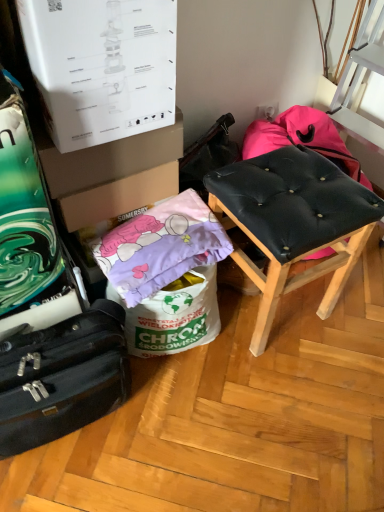
Question: From a real-world perspective, is black leather stool at right located higher than brown cardboard box at upper left, acting as the second cardboard box starting from the bottom?

Choices:
 (A) yes
 (B) no

Answer: (B)

Question: Could brown cardboard box at upper left, which is counted as the first cardboard box, starting from the top, be considered to be inside black leather stool at right?

Choices:
 (A) no
 (B) yes

Answer: (A)

Question: Is black leather stool at right turned away from brown cardboard box at upper left, acting as the second cardboard box starting from the bottom?

Choices:
 (A) yes
 (B) no

Answer: (B)

Question: Is black leather stool at right at the left side of brown cardboard box at upper left, which is counted as the first cardboard box, starting from the top?

Choices:
 (A) yes
 (B) no

Answer: (B)

Question: From the image's perspective, would you say black leather stool at right is shown under brown cardboard box at upper left, acting as the second cardboard box starting from the bottom?

Choices:
 (A) yes
 (B) no

Answer: (A)

Question: Considering their positions, is purple fabric pillow at lower left located in front of or behind brown cardboard box at center, marked as the 2th cardboard box in a top-to-bottom arrangement?

Choices:
 (A) front
 (B) behind

Answer: (A)

Question: Considering the positions of purple fabric pillow at lower left and brown cardboard box at center, marked as the 2th cardboard box in a top-to-bottom arrangement, in the image, is purple fabric pillow at lower left bigger or smaller than brown cardboard box at center, marked as the 2th cardboard box in a top-to-bottom arrangement,?

Choices:
 (A) big
 (B) small

Answer: (A)

Question: Choose the correct answer: Is purple fabric pillow at lower left inside brown cardboard box at center, marked as the 2th cardboard box in a top-to-bottom arrangement, or outside it?

Choices:
 (A) outside
 (B) inside

Answer: (A)

Question: From the image's perspective, relative to brown cardboard box at center, the 1th cardboard box positioned from the bottom, is purple fabric pillow at lower left above or below?

Choices:
 (A) below
 (B) above

Answer: (A)

Question: In the image, is brown cardboard box at upper left, acting as the second cardboard box starting from the bottom, positioned in front of or behind black leather stool at right?

Choices:
 (A) behind
 (B) front

Answer: (A)

Question: Based on their sizes in the image, would you say brown cardboard box at upper left, acting as the second cardboard box starting from the bottom, is bigger or smaller than black leather stool at right?

Choices:
 (A) small
 (B) big

Answer: (A)

Question: Is brown cardboard box at upper left, which is counted as the first cardboard box, starting from the top, inside or outside of black leather stool at right?

Choices:
 (A) inside
 (B) outside

Answer: (B)

Question: From the image's perspective, is brown cardboard box at upper left, which is counted as the first cardboard box, starting from the top, located above or below black leather stool at right?

Choices:
 (A) below
 (B) above

Answer: (B)

Question: Looking at the image, does black leather stool at right seem bigger or smaller compared to brown cardboard box at center, marked as the 2th cardboard box in a top-to-bottom arrangement?

Choices:
 (A) small
 (B) big

Answer: (B)

Question: Considering the positions of black leather stool at right and brown cardboard box at center, marked as the 2th cardboard box in a top-to-bottom arrangement, in the image, is black leather stool at right taller or shorter than brown cardboard box at center, marked as the 2th cardboard box in a top-to-bottom arrangement,?

Choices:
 (A) short
 (B) tall

Answer: (B)